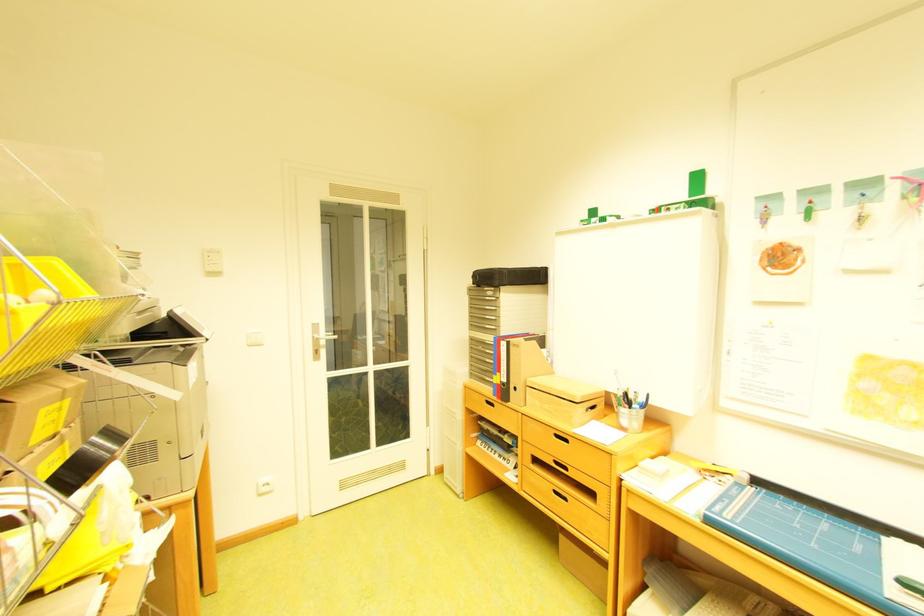
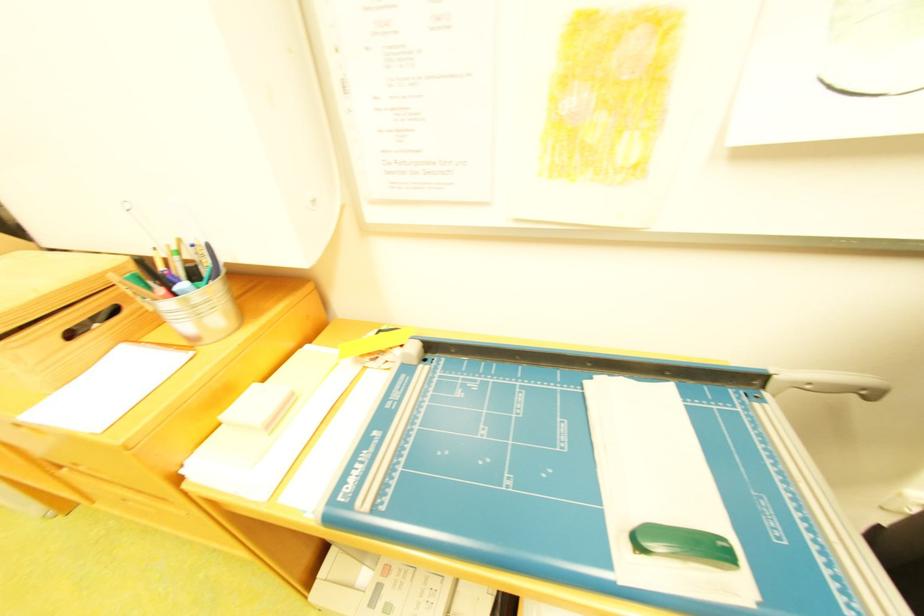
Where in the second image is the point corresponding to (x=895, y=540) from the first image?

(598, 384)